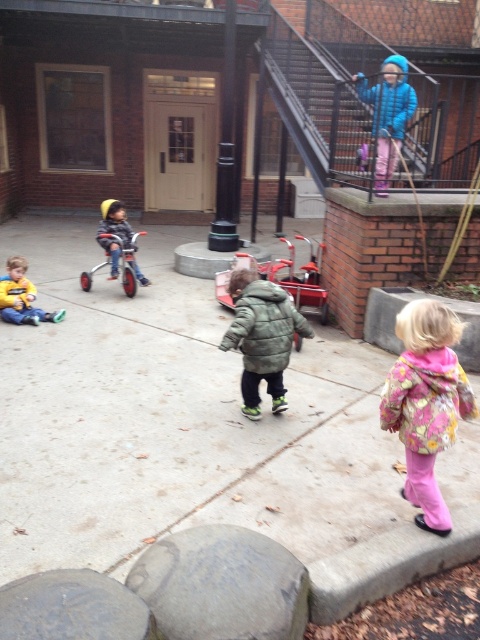
You are a parent trying to decide whether to let your child play near the blue fabric stair at upper right and the metallic red tricycle at center. Considering their sizes, which object takes up more space in the courtyard?

The blue fabric stair at upper right takes up more space in the courtyard because it has a larger size compared to the metallic red tricycle at center.

You are a parent trying to decide whether to let your child ride the metallic red tricycle at center up the blue fabric stair at upper right. Based on the objects in the scene, is this a safe idea?

The blue fabric stair at upper right is thinner than the metallic red tricycle at center, so riding the metallic red tricycle at center up the blue fabric stair at upper right may not be safe due to the stair being narrower than the tricycle.